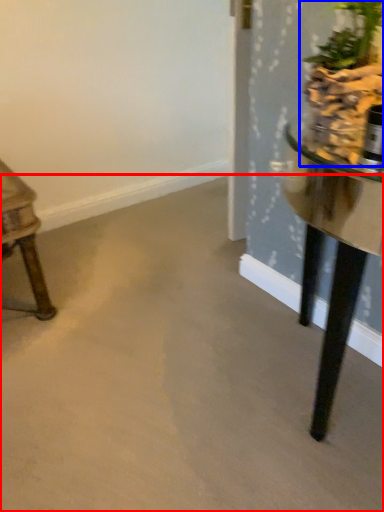
Question: Which object appears closest to the camera in this image, concrete (highlighted by a red box) or houseplant (highlighted by a blue box)?

Choices:
 (A) concrete
 (B) houseplant

Answer: (A)